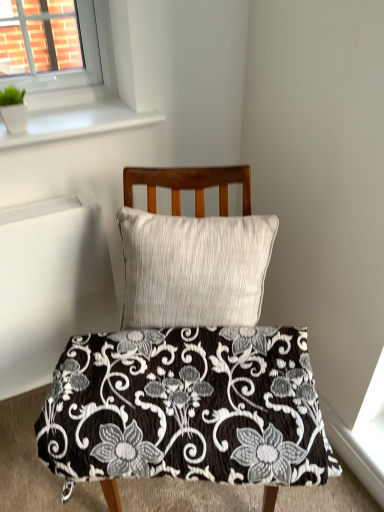
Question: Can we say black quilted fabric at center lies outside white plastic radiator at left?

Choices:
 (A) yes
 (B) no

Answer: (A)

Question: Is black quilted fabric at center not near white plastic radiator at left?

Choices:
 (A) no
 (B) yes

Answer: (A)

Question: Does black quilted fabric at center have a lesser width compared to white plastic radiator at left?

Choices:
 (A) no
 (B) yes

Answer: (A)

Question: Does black quilted fabric at center appear on the left side of white plastic radiator at left?

Choices:
 (A) yes
 (B) no

Answer: (B)

Question: Does black quilted fabric at center turn towards white plastic radiator at left?

Choices:
 (A) no
 (B) yes

Answer: (A)

Question: Is black quilted fabric at center wider than white plastic radiator at left?

Choices:
 (A) no
 (B) yes

Answer: (B)

Question: Is black quilted fabric at center taller than black quilted cushion at center?

Choices:
 (A) no
 (B) yes

Answer: (A)

Question: Can you confirm if black quilted fabric at center is positioned to the right of black quilted cushion at center?

Choices:
 (A) no
 (B) yes

Answer: (B)

Question: Is black quilted fabric at center positioned far away from black quilted cushion at center?

Choices:
 (A) yes
 (B) no

Answer: (B)

Question: Is black quilted fabric at center positioned before black quilted cushion at center?

Choices:
 (A) yes
 (B) no

Answer: (B)

Question: Can you confirm if black quilted fabric at center is smaller than black quilted cushion at center?

Choices:
 (A) yes
 (B) no

Answer: (A)

Question: Considering the relative sizes of black quilted fabric at center and black quilted cushion at center in the image provided, is black quilted fabric at center wider than black quilted cushion at center?

Choices:
 (A) yes
 (B) no

Answer: (B)

Question: Is white ceramic pot at upper left oriented towards white plastic radiator at left?

Choices:
 (A) yes
 (B) no

Answer: (B)